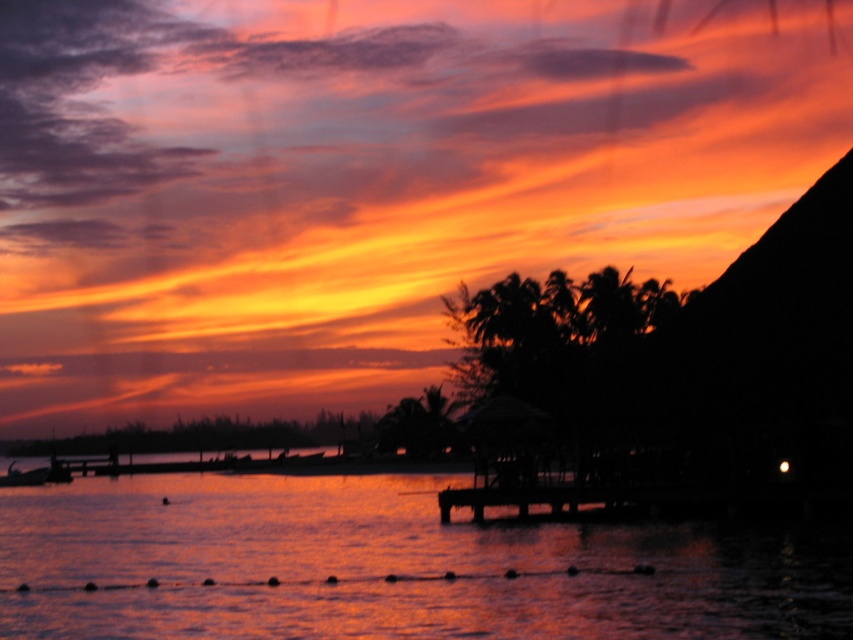
Who is taller, shiny reflective water at center or metallic silver boat at lower left?

Standing taller between the two is shiny reflective water at center.

Can you confirm if shiny reflective water at center is positioned to the left of metallic silver boat at lower left?

No, shiny reflective water at center is not to the left of metallic silver boat at lower left.

Locate an element on the screen. This screenshot has width=853, height=640. shiny reflective water at center is located at coordinates (392, 566).

Who is higher up, shiny reflective water at center or black wood dock at center?

black wood dock at center

Which of these two, shiny reflective water at center or black wood dock at center, stands shorter?

black wood dock at center is shorter.

What are the coordinates of `shiny reflective water at center` in the screenshot? It's located at (392, 566).

Is black wood dock at center to the left of metallic silver boat at lower left from the viewer's perspective?

No, black wood dock at center is not to the left of metallic silver boat at lower left.

Is point (596, 500) farther from camera compared to point (59, 476)?

That is False.

The width and height of the screenshot is (853, 640). I want to click on black wood dock at center, so click(x=541, y=497).